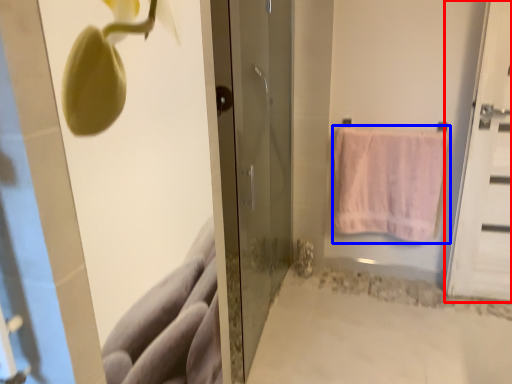
Question: Which of the following is the farthest to the observer, door (highlighted by a red box) or towel (highlighted by a blue box)?

Choices:
 (A) door
 (B) towel

Answer: (B)